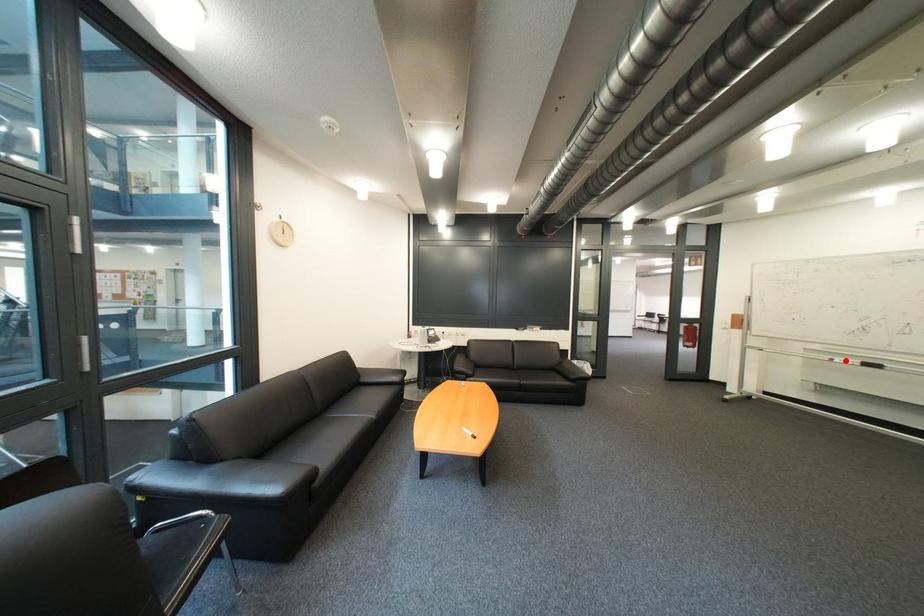
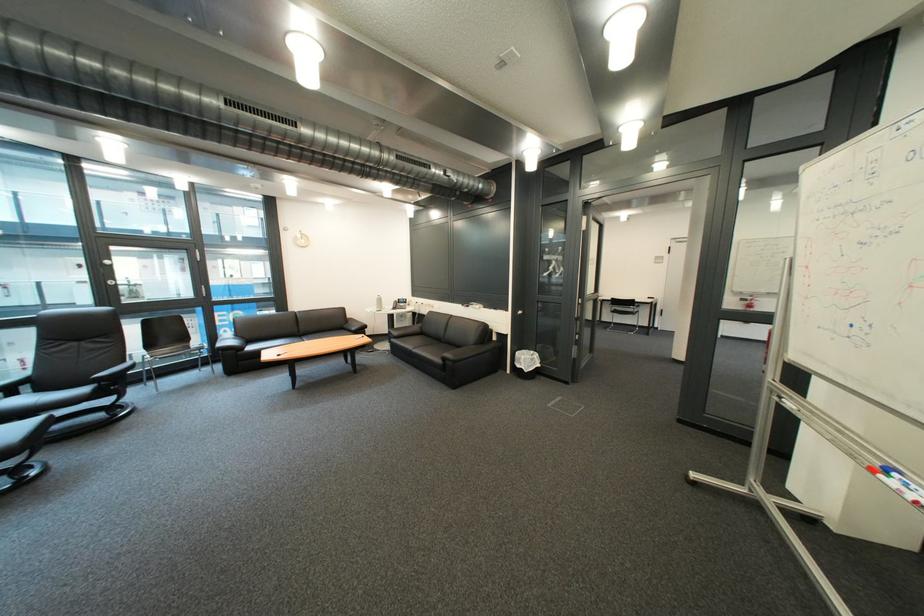
Question: A red point is marked in image1. In image2, is the corresponding 3D point closer to the camera or farther? Reply with the corresponding letter.

Choices:
 (A) The corresponding 3D point is closer.
 (B) The corresponding 3D point is farther.

Answer: (B)